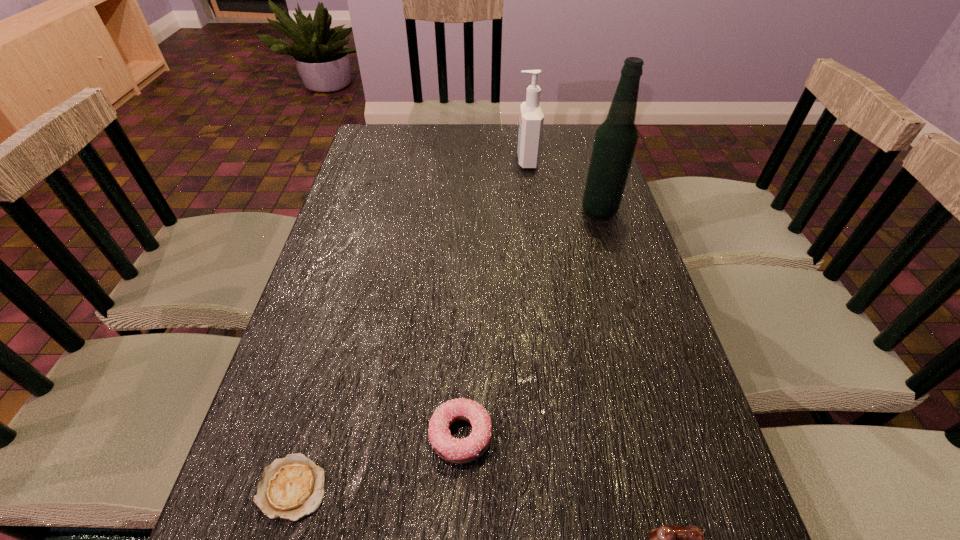
Where is `the second farthest object`? the second farthest object is located at coordinates (616, 138).

Locate an element on the screen. the tallest object is located at coordinates (616, 138).

Identify the location of cleansing agent. (531, 120).

Locate an element on the screen. the farthest object is located at coordinates (531, 120).

I want to click on the fourth object from right to left, so click(x=459, y=451).

You are a GUI agent. You are given a task and a screenshot of the screen. Output one action in this format:
    pyautogui.click(x=<x>, y=<y>)
    Task: Click on the doughnut
    
    Given the screenshot: What is the action you would take?
    tap(459, 451)

Identify the location of the shortest object. (292, 487).

Identify the location of quiche. click(x=292, y=487).

The image size is (960, 540). What are the coordinates of `vacant region located on the left of the tallest object` in the screenshot? It's located at (464, 210).

Where is `free region located 0.150m on the front label of the second tallest object`? This screenshot has height=540, width=960. free region located 0.150m on the front label of the second tallest object is located at coordinates (470, 160).